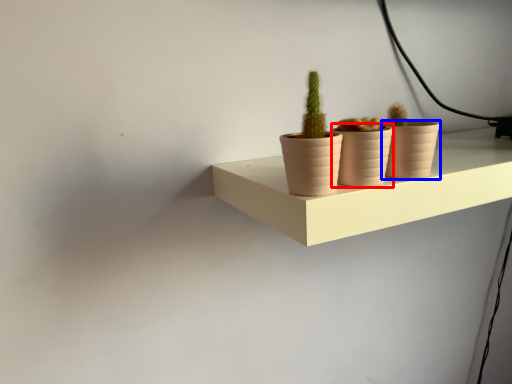
Question: Which object appears closest to the camera in this image, flowerpot (highlighted by a red box) or flowerpot (highlighted by a blue box)?

Choices:
 (A) flowerpot
 (B) flowerpot

Answer: (A)